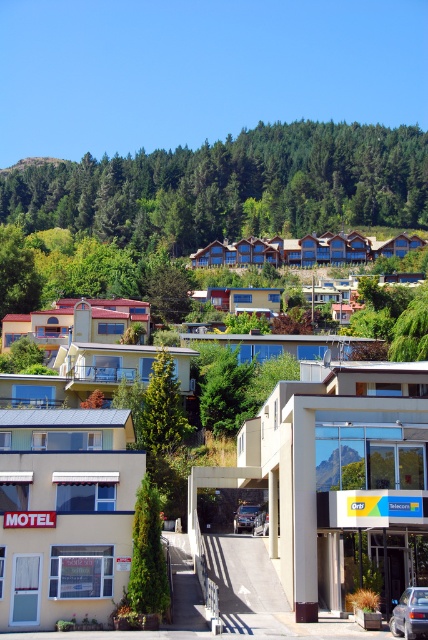
Is beige concrete building at center thinner than beige matte motel at lower left?

In fact, beige concrete building at center might be wider than beige matte motel at lower left.

Is beige concrete building at center shorter than beige matte motel at lower left?

In fact, beige concrete building at center may be taller than beige matte motel at lower left.

Which is behind, point (422, 492) or point (107, 468)?

The point (107, 468) is more distant.

Where is `beige concrete building at center`? The height and width of the screenshot is (640, 428). beige concrete building at center is located at coordinates (336, 477).

Is point (395, 237) positioned in front of point (253, 513)?

No.

Which is in front, point (243, 264) or point (249, 522)?

Point (249, 522)

Between point (273, 243) and point (252, 524), which one is positioned in front?

Point (252, 524) is more forward.

Image resolution: width=428 pixels, height=640 pixels. Find the location of `blue wooden hotel at center`. blue wooden hotel at center is located at coordinates [305, 250].

Between beige matte motel at lower left and metallic silver sedan at lower right, which one is positioned higher?

beige matte motel at lower left

Which is behind, point (103, 484) or point (389, 625)?

Point (103, 484)

The height and width of the screenshot is (640, 428). Describe the element at coordinates (65, 513) in the screenshot. I see `beige matte motel at lower left` at that location.

At what (x,y) coordinates should I click in order to perform the action: click on beige matte motel at lower left. Please return your answer as a coordinate pair (x, y). The height and width of the screenshot is (640, 428). Looking at the image, I should click on (65, 513).